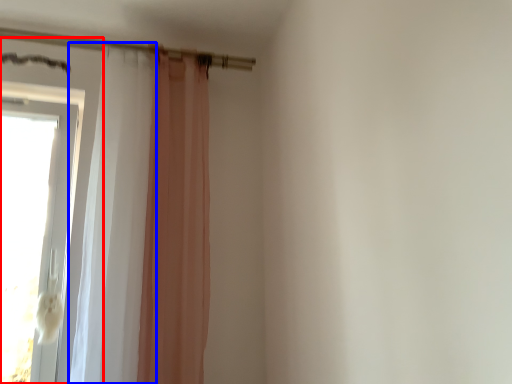
Question: Which object is further to the camera taking this photo, door (highlighted by a red box) or shower curtain (highlighted by a blue box)?

Choices:
 (A) door
 (B) shower curtain

Answer: (A)